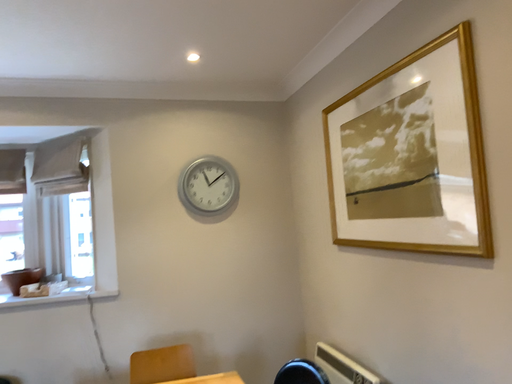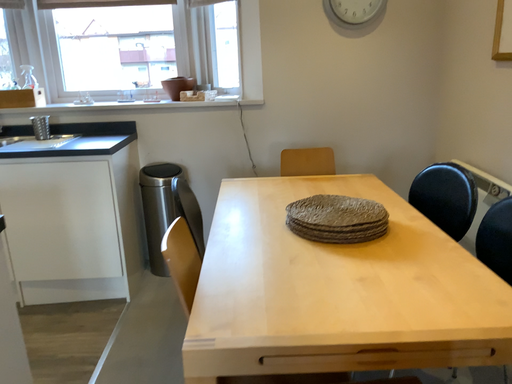
Question: How did the camera likely rotate when shooting the video?

Choices:
 (A) rotated upward
 (B) rotated downward

Answer: (B)